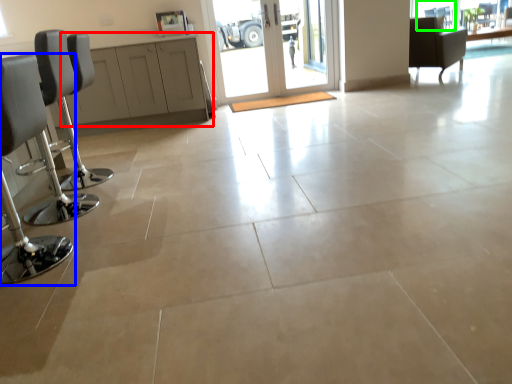
Question: Which object is the farthest from cabinetry (highlighted by a red box)? Choose among these: chair (highlighted by a blue box) or window (highlighted by a green box).

Choices:
 (A) chair
 (B) window

Answer: (B)